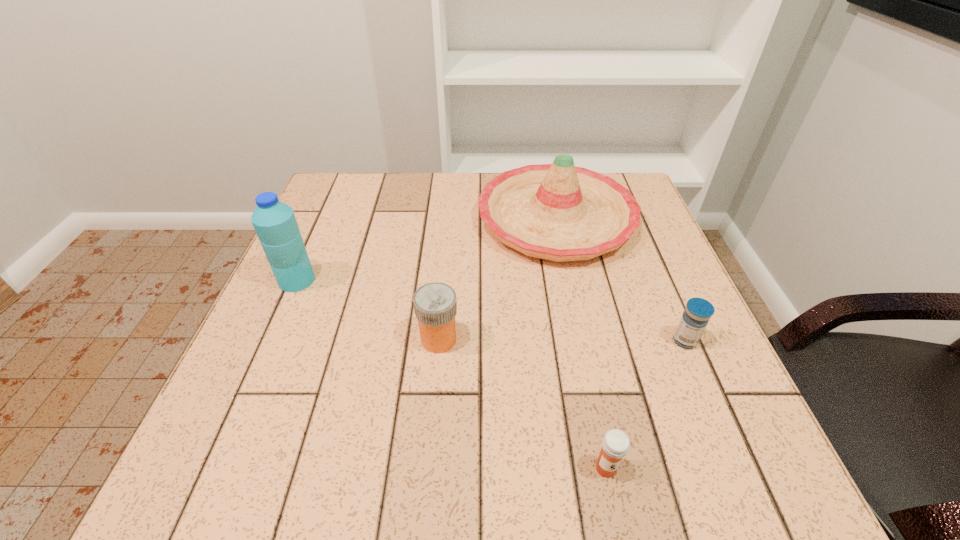
Find the location of a particular element. vacant space located on the label side of the second object from left to right is located at coordinates (537, 339).

You are a GUI agent. You are given a task and a screenshot of the screen. Output one action in this format:
    pyautogui.click(x=<x>, y=<y>)
    Task: Click on the free spot located on the back of the rightmost medicine
    The height and width of the screenshot is (540, 960).
    Given the screenshot: What is the action you would take?
    pyautogui.click(x=643, y=245)

Locate an element on the screen. This screenshot has width=960, height=540. object that is at the far edge is located at coordinates (558, 212).

This screenshot has height=540, width=960. In order to click on object situated at the near edge in this screenshot , I will do `click(615, 444)`.

Where is `object at the left edge`? The width and height of the screenshot is (960, 540). object at the left edge is located at coordinates (274, 221).

At what (x,y) coordinates should I click in order to perform the action: click on sombrero that is at the right edge. Please return your answer as a coordinate pair (x, y). The height and width of the screenshot is (540, 960). Looking at the image, I should click on (558, 212).

In order to click on medicine present at the right edge in this screenshot , I will do `click(698, 311)`.

Locate an element on the screen. This screenshot has height=540, width=960. object situated at the far right corner is located at coordinates (558, 212).

In the image, there is a desktop. At what (x,y) coordinates should I click in order to perform the action: click on vacant space at the far edge. Please return your answer as a coordinate pair (x, y). Looking at the image, I should click on (448, 172).

The width and height of the screenshot is (960, 540). In the image, there is a desktop. In order to click on blank space at the left edge in this screenshot , I will do `click(311, 247)`.